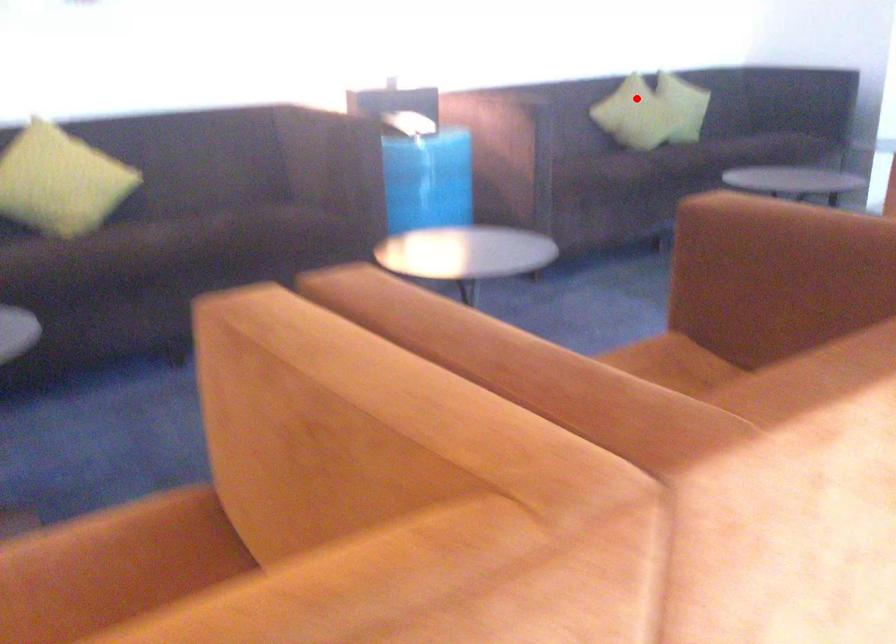
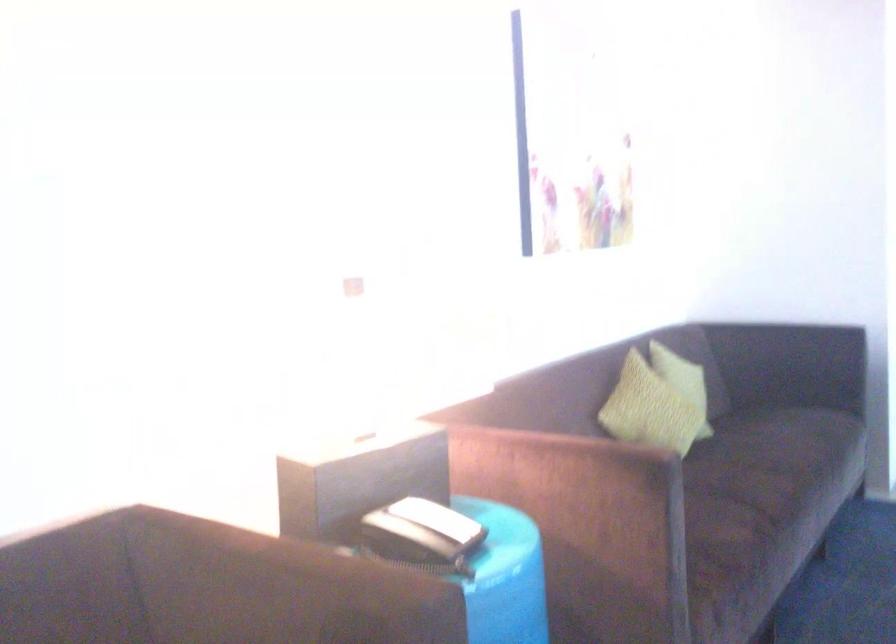
In the second image, find the point that corresponds to the highlighted location in the first image.

(648, 410)